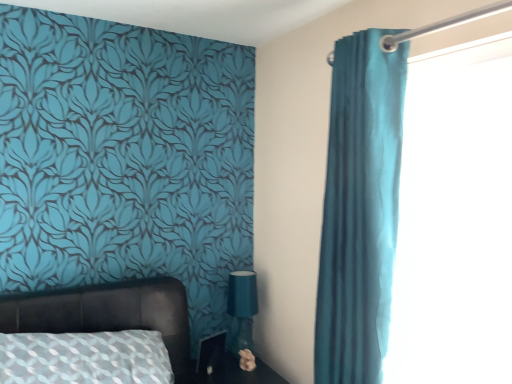
Identify the location of fluffy beige flower at lower center. The image size is (512, 384). (247, 360).

Based on the photo, in order to face teal fabric curtain at right, should I rotate leftwards or rightwards?

Turn right by 13.692 degrees to look at teal fabric curtain at right.

What do you see at coordinates (360, 209) in the screenshot?
I see `teal fabric curtain at right` at bounding box center [360, 209].

Measure the distance between matte black side table at lower center and camera.

matte black side table at lower center is 2.19 meters from camera.

Locate an element on the screen. This screenshot has height=384, width=512. matte teal fabric at lower center is located at coordinates (242, 307).

Can we say matte teal fabric at lower center lies outside leather-like bed at lower left?

matte teal fabric at lower center lies outside leather-like bed at lower left's area.

Does matte teal fabric at lower center have a smaller size compared to leather-like bed at lower left?

Indeed, matte teal fabric at lower center has a smaller size compared to leather-like bed at lower left.

Which object is wider, matte teal fabric at lower center or leather-like bed at lower left?

With larger width is leather-like bed at lower left.

Which object is positioned more to the left, matte black side table at lower center or fluffy beige flower at lower center?

From the viewer's perspective, matte black side table at lower center appears more on the left side.

In the scene shown: Is matte black side table at lower center positioned with its back to fluffy beige flower at lower center?

That's not correct — matte black side table at lower center is not looking away from fluffy beige flower at lower center.

Are matte black side table at lower center and fluffy beige flower at lower center located far from each other?

No, matte black side table at lower center is not far away from fluffy beige flower at lower center.

How many degrees apart are the facing directions of matte black side table at lower center and fluffy beige flower at lower center?

54.1 degrees.

From the image's perspective, is fluffy beige flower at lower center beneath leather-like bed at lower left?

Yes, from the image's perspective, fluffy beige flower at lower center is beneath leather-like bed at lower left.

Between fluffy beige flower at lower center and leather-like bed at lower left, which one has larger size?

With larger size is leather-like bed at lower left.

Between fluffy beige flower at lower center and leather-like bed at lower left, which one has larger width?

leather-like bed at lower left.

From a real-world perspective, relative to leather-like bed at lower left, is fluffy beige flower at lower center vertically above or below?

In terms of real-world spatial position, fluffy beige flower at lower center is below leather-like bed at lower left.

From a real-world perspective, who is located lower, fluffy beige flower at lower center or teal fabric curtain at right?

From a 3D spatial view, fluffy beige flower at lower center is below.

Locate an element on the screen. Image resolution: width=512 pixels, height=384 pixels. flower lying below the teal fabric curtain at right (from the image's perspective) is located at coordinates (247, 360).

How different are the orientations of fluffy beige flower at lower center and teal fabric curtain at right in degrees?

There is a 38.1-degree angle between the facing directions of fluffy beige flower at lower center and teal fabric curtain at right.

Between leather-like bed at lower left and fluffy beige flower at lower center, which one has smaller size?

Smaller between the two is fluffy beige flower at lower center.

Identify the location of bed lying above the fluffy beige flower at lower center (from the image's perspective). (106, 312).

What's the angular difference between leather-like bed at lower left and fluffy beige flower at lower center's facing directions?

The angular difference between leather-like bed at lower left and fluffy beige flower at lower center is 54.7 degrees.

From a real-world perspective, is leather-like bed at lower left positioned above or below fluffy beige flower at lower center?

leather-like bed at lower left is above fluffy beige flower at lower center.

Does point (471, 199) come in front of point (377, 355)?

Yes, it is.

From a real-world perspective, who is located lower, teal fabric curtain at right or teal fabric curtain at right?

teal fabric curtain at right.

Would you say teal fabric curtain at right is outside teal fabric curtain at right?

Yes, teal fabric curtain at right is outside of teal fabric curtain at right.

Which of these two, matte teal fabric at lower center or fluffy beige flower at lower center, is wider?

matte teal fabric at lower center.

Considering the sizes of objects matte teal fabric at lower center and fluffy beige flower at lower center in the image provided, who is shorter, matte teal fabric at lower center or fluffy beige flower at lower center?

fluffy beige flower at lower center.

Find the location of `table lamp positioned vertically above the fluffy beige flower at lower center (from a real-world perspective)`. table lamp positioned vertically above the fluffy beige flower at lower center (from a real-world perspective) is located at coordinates (242, 307).

Identify the location of bed in front of the matte teal fabric at lower center. The image size is (512, 384). (106, 312).

In the image, there is a fluffy beige flower at lower center. Find the location of `side table below it (from the image's perspective)`. side table below it (from the image's perspective) is located at coordinates (231, 373).

When comparing their distances from teal fabric curtain at right, does leather-like bed at lower left or fluffy beige flower at lower center seem closer?

Based on the image, leather-like bed at lower left appears to be nearer to teal fabric curtain at right.

Considering their positions, is matte teal fabric at lower center positioned closer to teal fabric curtain at right than fluffy beige flower at lower center?

matte teal fabric at lower center.

From the image, which object appears to be nearer to leather-like bed at lower left, teal fabric curtain at right or matte black side table at lower center?

matte black side table at lower center is closer to leather-like bed at lower left.

Looking at the image, which one is located closer to fluffy beige flower at lower center, matte teal fabric at lower center or matte black side table at lower center?

The object closer to fluffy beige flower at lower center is matte black side table at lower center.

From the image, which object appears to be farther from leather-like bed at lower left, teal fabric curtain at right or teal fabric curtain at right?

teal fabric curtain at right is positioned further to the anchor leather-like bed at lower left.

When comparing their distances from leather-like bed at lower left, does matte black side table at lower center or matte teal fabric at lower center seem further?

matte teal fabric at lower center.

Consider the image. Considering their positions, is fluffy beige flower at lower center positioned further to leather-like bed at lower left than teal fabric curtain at right?

teal fabric curtain at right lies further to leather-like bed at lower left than the other object.

Looking at the image, which one is located closer to matte teal fabric at lower center, teal fabric curtain at right or leather-like bed at lower left?

leather-like bed at lower left is closer to matte teal fabric at lower center.

Identify the location of curtain between leather-like bed at lower left and teal fabric curtain at right. (360, 209).

Where is `curtain between teal fabric curtain at right and fluffy beige flower at lower center in the front-back direction`? curtain between teal fabric curtain at right and fluffy beige flower at lower center in the front-back direction is located at coordinates (360, 209).

You are a GUI agent. You are given a task and a screenshot of the screen. Output one action in this format:
    pyautogui.click(x=<x>, y=<y>)
    Task: Click on the curtain between leather-like bed at lower left and fluffy beige flower at lower center in the front-back direction
    This screenshot has height=384, width=512.
    Given the screenshot: What is the action you would take?
    pos(360,209)

You are a GUI agent. You are given a task and a screenshot of the screen. Output one action in this format:
    pyautogui.click(x=<x>, y=<y>)
    Task: Click on the flower between matte teal fabric at lower center and matte black side table at lower center from top to bottom
    The width and height of the screenshot is (512, 384).
    Given the screenshot: What is the action you would take?
    pyautogui.click(x=247, y=360)